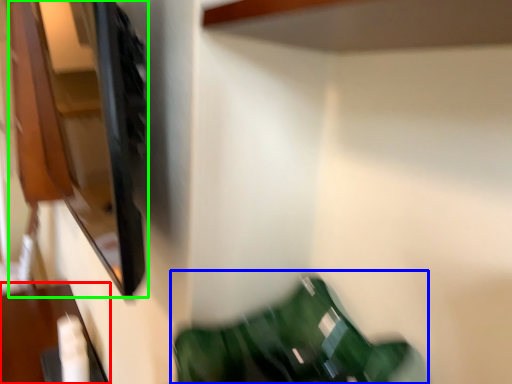
Question: Which is farther away from furniture (highlighted by a red box)? bean bag chair (highlighted by a blue box) or cabinet (highlighted by a green box)?

Choices:
 (A) bean bag chair
 (B) cabinet

Answer: (B)